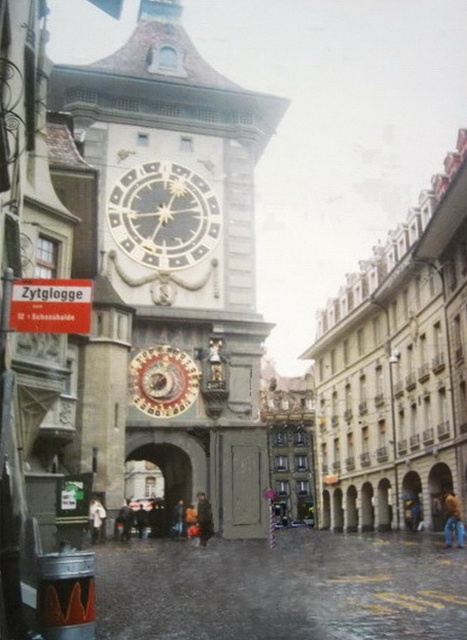
Question: Does stone clock tower at center appear under dark gray metal clock at center?

Choices:
 (A) yes
 (B) no

Answer: (B)

Question: Can you confirm if stone clock tower at center is smaller than dark gray metal clock at center?

Choices:
 (A) yes
 (B) no

Answer: (B)

Question: Is stone clock tower at center bigger than dark gray metal clock at center?

Choices:
 (A) yes
 (B) no

Answer: (A)